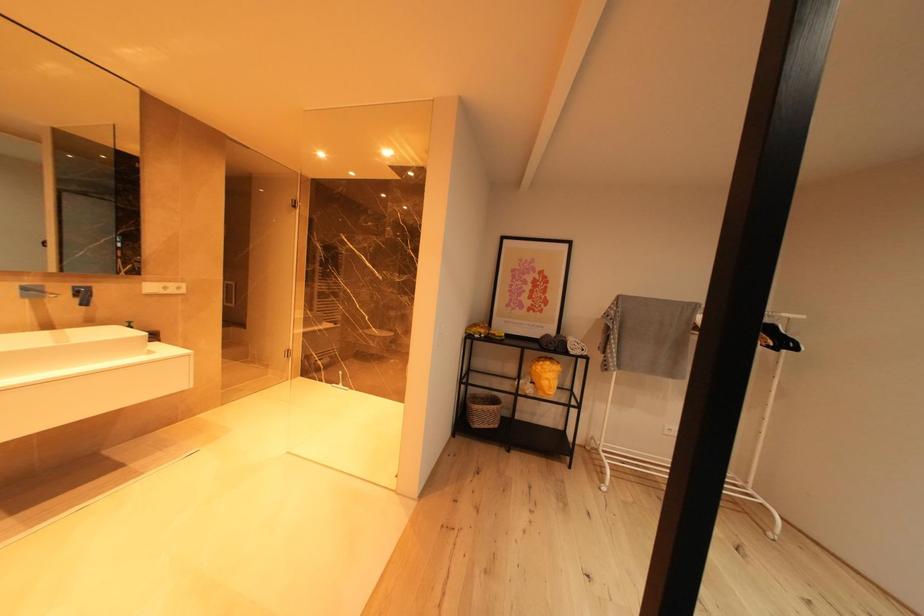
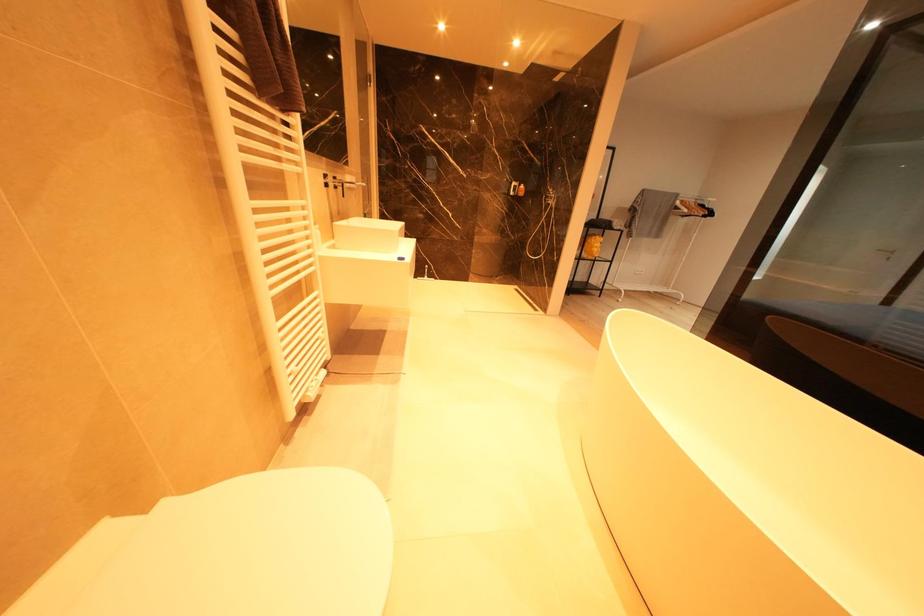
Question: What movement of the cameraman would produce the second image?

Choices:
 (A) Left
 (B) Right
 (C) Forward
 (D) Backward

Answer: (A)